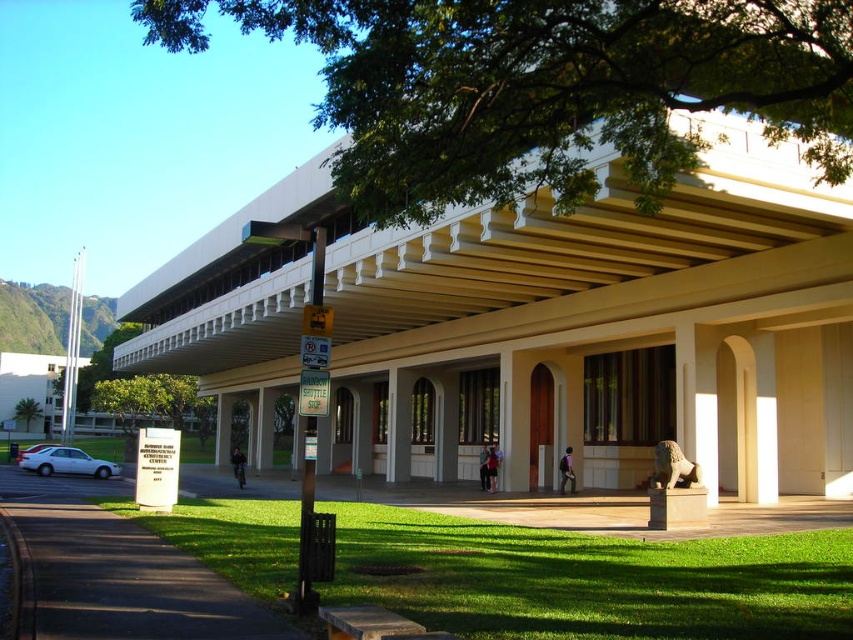
You are a visitor approaching the building and notice the green leafy tree at upper center and the dark asphalt pavement at lower left. Which object is higher in the image?

The green leafy tree at upper center is taller than the dark asphalt pavement at lower left, so the green leafy tree at upper center is higher in the image.

You are a delivery person approaching the entrance of the building. You need to place a heavy box on the ground near the dark asphalt pavement at lower left and the white matte sedan at lower left. Which surface should you choose to ensure the box stays elevated to avoid water accumulation during rain?

The white matte sedan at lower left has a greater height than the dark asphalt pavement at lower left, so placing the box on the white matte sedan at lower left would keep it elevated and safe from water during rain.